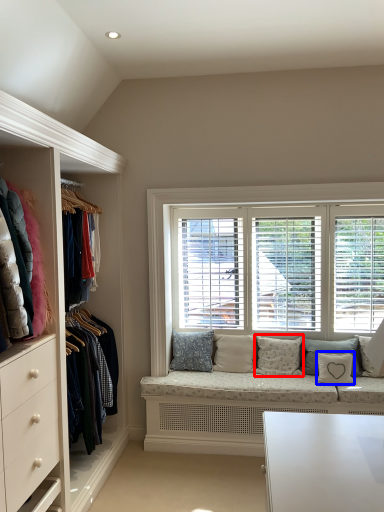
Question: Which point is closer to the camera, pillow (highlighted by a red box) or pillow (highlighted by a blue box)?

Choices:
 (A) pillow
 (B) pillow

Answer: (B)